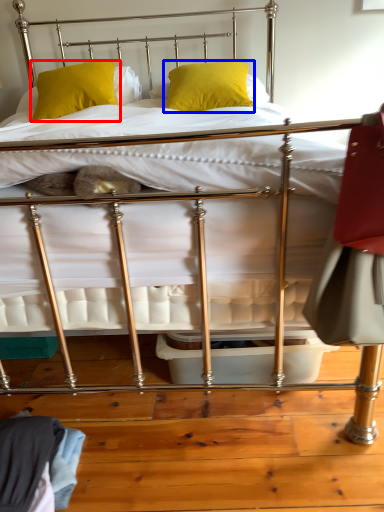
Question: Among these objects, which one is nearest to the camera, pillow (highlighted by a red box) or pillow (highlighted by a blue box)?

Choices:
 (A) pillow
 (B) pillow

Answer: (B)